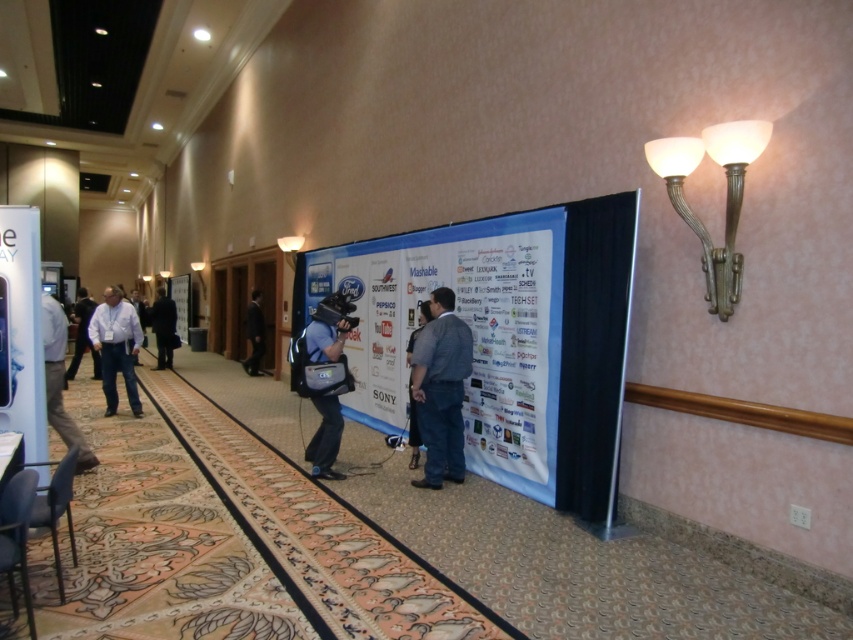
Does dark gray suit at center come behind blue fabric camera at center?

No, it is in front of blue fabric camera at center.

Describe the element at coordinates (440, 388) in the screenshot. I see `dark gray suit at center` at that location.

Find the location of a particular element. This screenshot has width=853, height=640. dark gray suit at center is located at coordinates (440, 388).

Can you confirm if gold metallic wall sconce at upper right is taller than dark blue suit at center?

No, gold metallic wall sconce at upper right is not taller than dark blue suit at center.

Does point (729, 292) lie in front of point (155, 369)?

Yes, point (729, 292) is closer to viewer.

Image resolution: width=853 pixels, height=640 pixels. I want to click on gold metallic wall sconce at upper right, so click(x=726, y=195).

Does point (312, 435) come farther from viewer compared to point (257, 320)?

No, it is in front of (257, 320).

Is blue fabric camera at center taller than black suit at center?

Incorrect, blue fabric camera at center's height is not larger of black suit at center's.

Where is `blue fabric camera at center`? The image size is (853, 640). blue fabric camera at center is located at coordinates (328, 330).